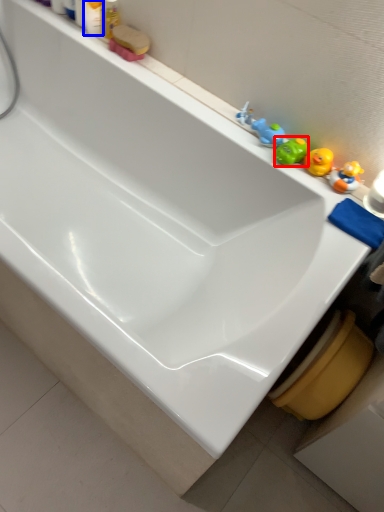
Question: Among these objects, which one is nearest to the camera, toy (highlighted by a red box) or toiletry (highlighted by a blue box)?

Choices:
 (A) toy
 (B) toiletry

Answer: (A)